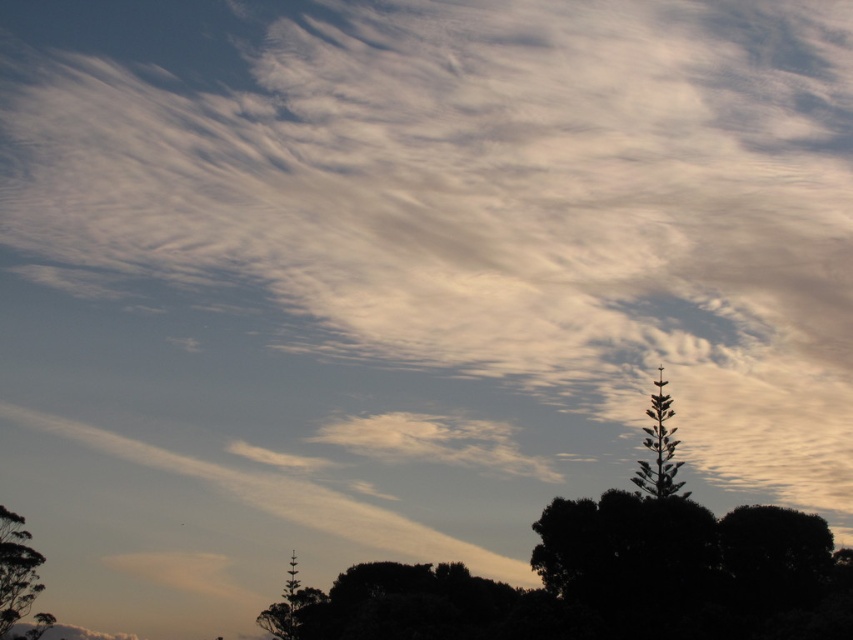
Question: Considering the relative positions of green leafy tree at upper right and green leafy tree at center in the image provided, where is green leafy tree at upper right located with respect to green leafy tree at center?

Choices:
 (A) below
 (B) above

Answer: (B)

Question: Does green leafy tree at lower left have a greater width compared to green leafy tree at upper right?

Choices:
 (A) no
 (B) yes

Answer: (A)

Question: Among these objects, which one is farthest from the camera?

Choices:
 (A) green leafy tree at upper right
 (B) green leafy tree at lower left
 (C) green leafy tree at center

Answer: (C)

Question: Is green leafy tree at lower left in front of green leafy tree at upper right?

Choices:
 (A) no
 (B) yes

Answer: (B)

Question: Which point is farther to the camera?

Choices:
 (A) green leafy tree at upper right
 (B) green leafy tree at center
 (C) green leafy tree at lower left

Answer: (B)

Question: Which point is farther from the camera taking this photo?

Choices:
 (A) (289, 593)
 (B) (13, 538)
 (C) (665, 412)

Answer: (A)